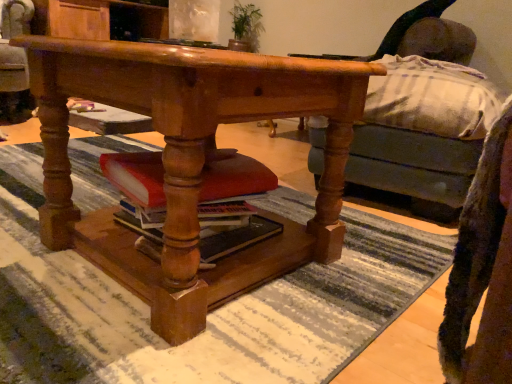
Question: Is wooden desk at center bigger than wooden swivel chair at center?

Choices:
 (A) no
 (B) yes

Answer: (A)

Question: Is wooden desk at center facing away from wooden swivel chair at center?

Choices:
 (A) yes
 (B) no

Answer: (B)

Question: Is wooden desk at center further to the viewer compared to wooden swivel chair at center?

Choices:
 (A) yes
 (B) no

Answer: (B)

Question: From the image's perspective, is wooden desk at center on top of wooden swivel chair at center?

Choices:
 (A) yes
 (B) no

Answer: (B)

Question: From the image's perspective, is wooden desk at center under wooden swivel chair at center?

Choices:
 (A) no
 (B) yes

Answer: (B)

Question: Is wooden desk at center beside wooden swivel chair at center?

Choices:
 (A) yes
 (B) no

Answer: (B)

Question: Would you consider green leafy plant at upper center to be distant from matte red book at center?

Choices:
 (A) no
 (B) yes

Answer: (B)

Question: Can we say green leafy plant at upper center lies outside matte red book at center?

Choices:
 (A) no
 (B) yes

Answer: (B)

Question: Can you confirm if green leafy plant at upper center is positioned to the right of matte red book at center?

Choices:
 (A) yes
 (B) no

Answer: (A)

Question: Does green leafy plant at upper center appear on the left side of matte red book at center?

Choices:
 (A) no
 (B) yes

Answer: (A)

Question: Is green leafy plant at upper center taller than matte red book at center?

Choices:
 (A) no
 (B) yes

Answer: (B)

Question: Can you confirm if green leafy plant at upper center is wider than matte red book at center?

Choices:
 (A) no
 (B) yes

Answer: (A)

Question: From the image's perspective, would you say matte red book at center is positioned over wooden swivel chair at center?

Choices:
 (A) yes
 (B) no

Answer: (B)